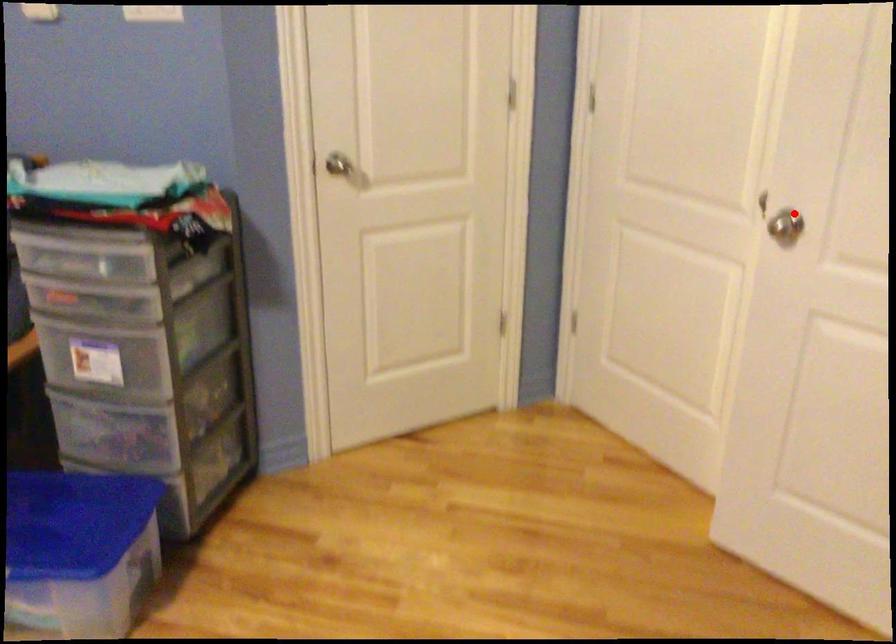
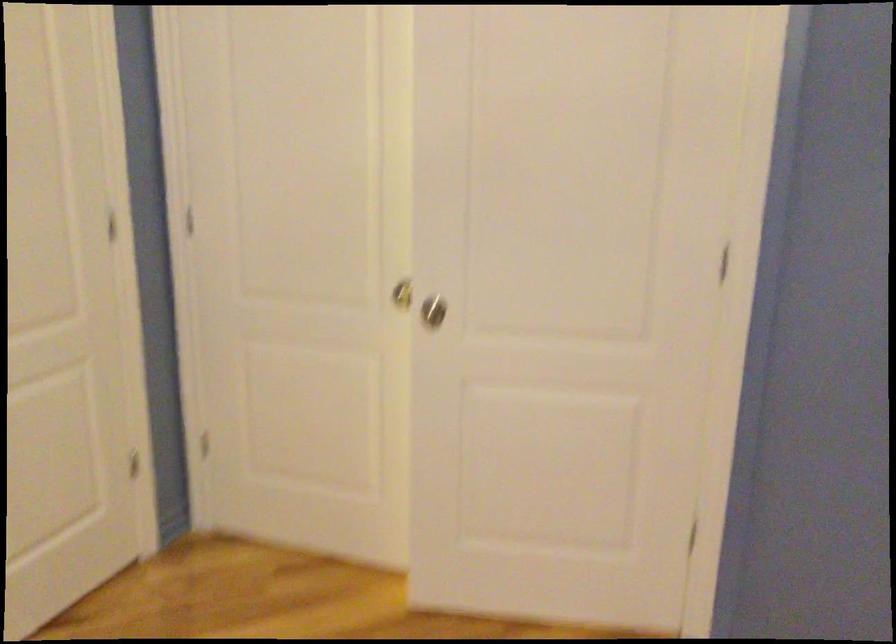
Locate, in the second image, the point that corresponds to the highlighted location in the first image.

(433, 310)